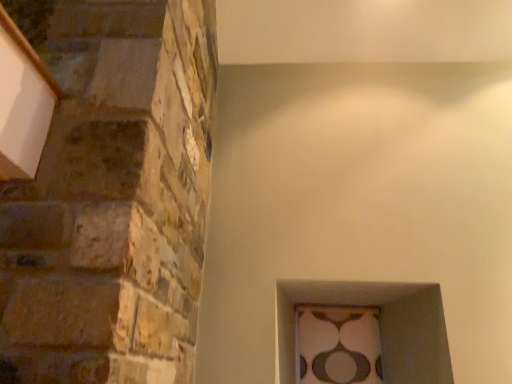
What do you see at coordinates (338, 345) in the screenshot?
I see `patterned glass door at lower right` at bounding box center [338, 345].

Identify the location of patterned glass door at lower right. This screenshot has height=384, width=512. (338, 345).

Locate an element on the screen. Image resolution: width=512 pixels, height=384 pixels. patterned glass door at lower right is located at coordinates (338, 345).